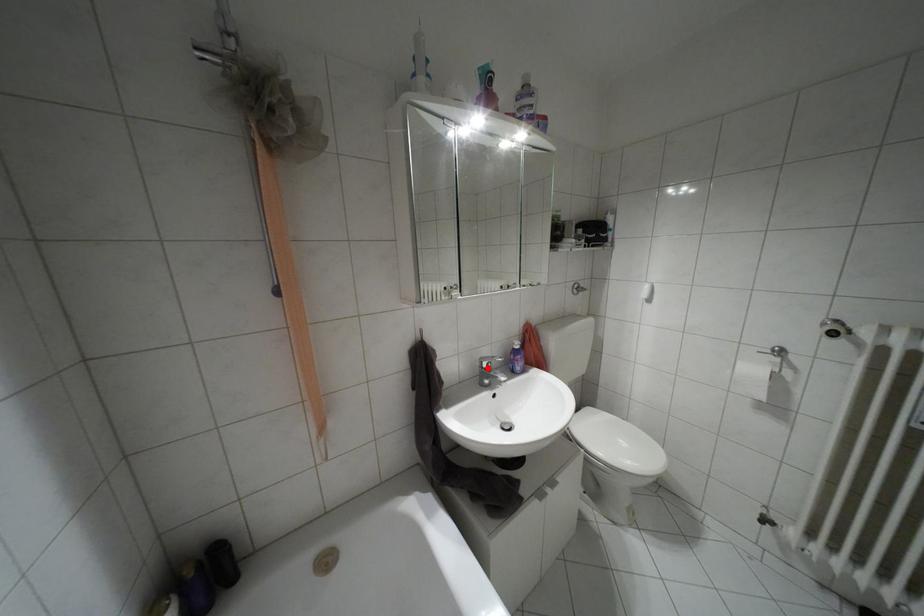
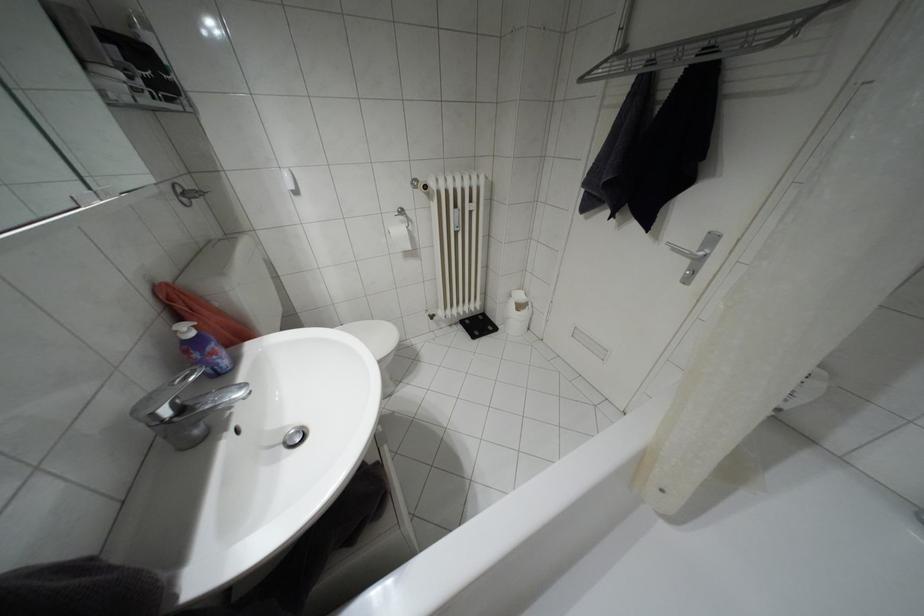
Where in the second image is the point corresponding to the highlighted location from the first image?

(180, 408)